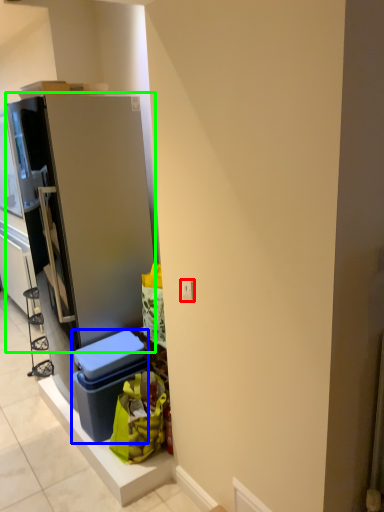
Question: Based on their relative distances, which object is nearer to electric outlet (highlighted by a red box)? Choose from storage box (highlighted by a blue box) and refrigerator (highlighted by a green box).

Choices:
 (A) storage box
 (B) refrigerator

Answer: (A)